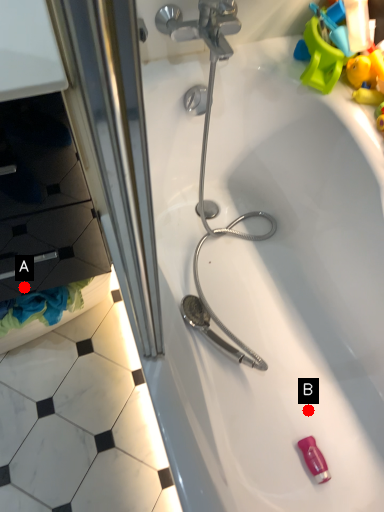
Question: Two points are circled on the image, labeled by A and B beside each circle. Which point is closer to the camera?

Choices:
 (A) A is closer
 (B) B is closer

Answer: (A)